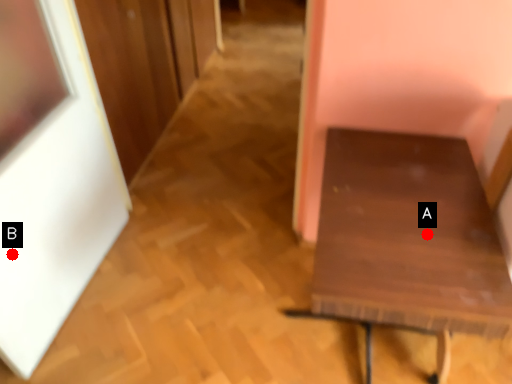
Question: Two points are circled on the image, labeled by A and B beside each circle. Among these points, which one is nearest to the camera?

Choices:
 (A) A is closer
 (B) B is closer

Answer: (A)